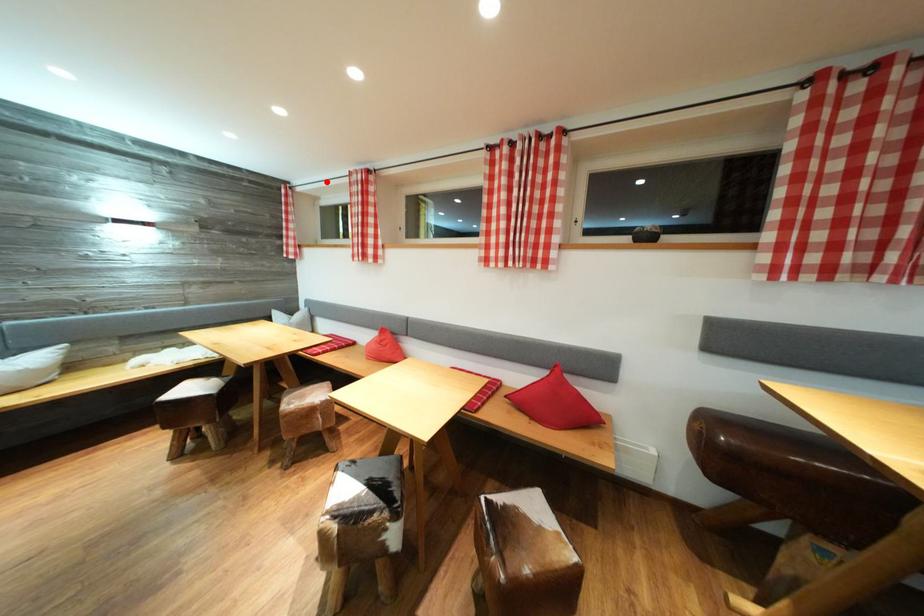
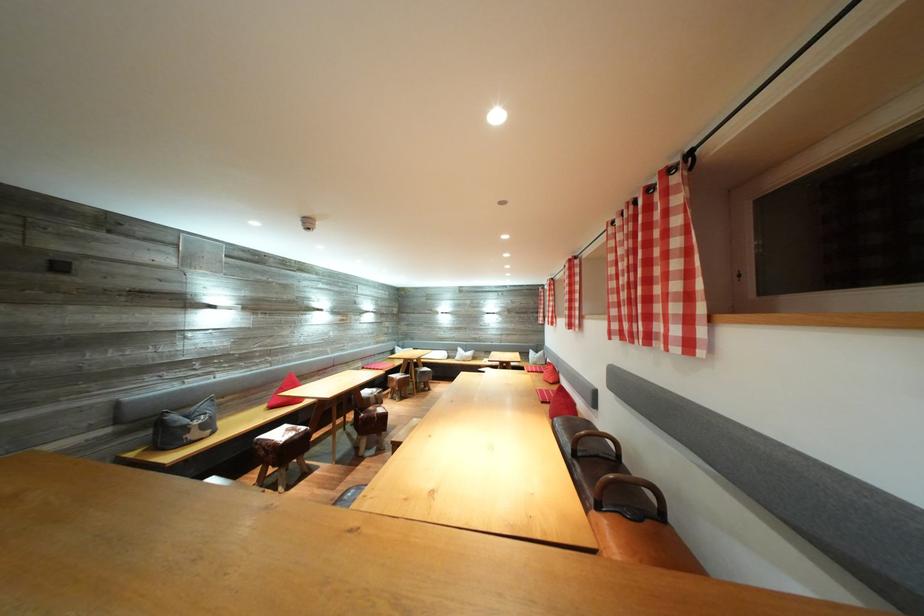
Find the pixel in the second image that matches the highlighted location in the first image.

(553, 288)